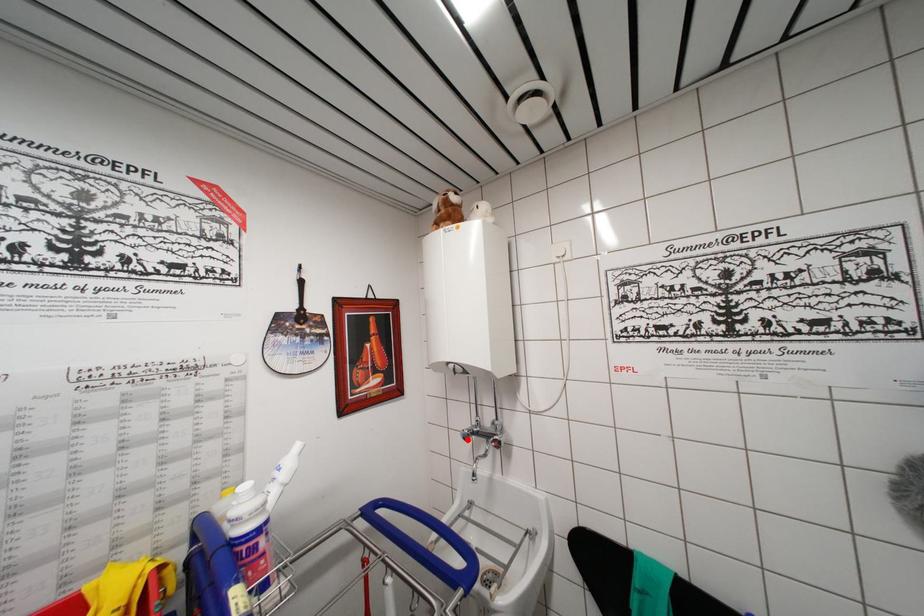
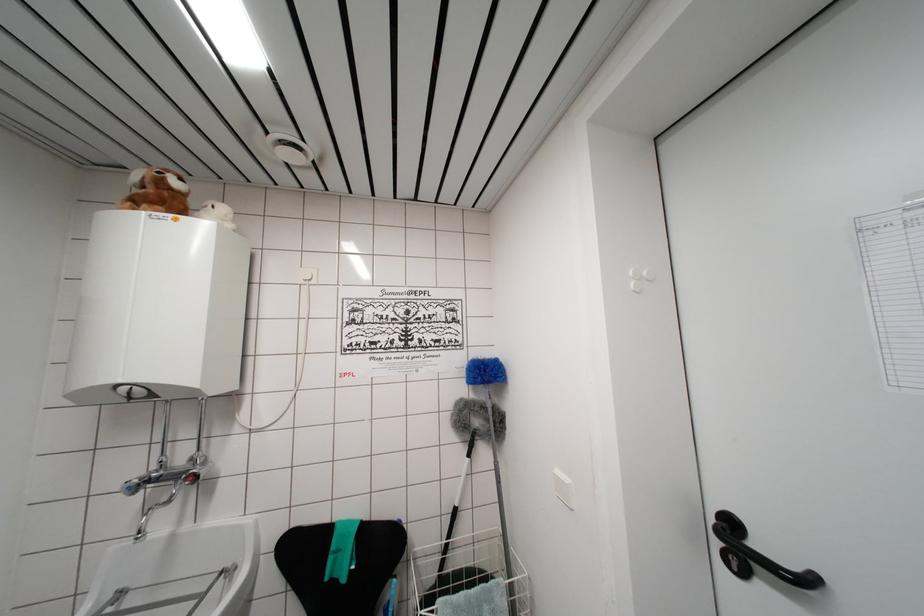
Question: I am providing you with two images of the same scene from different viewpoints. Image1 has a red point marked. In image2, the corresponding 3D location appears at what relative position? Reply with the corresponding letter.

Choices:
 (A) Closer
 (B) Farther

Answer: (A)